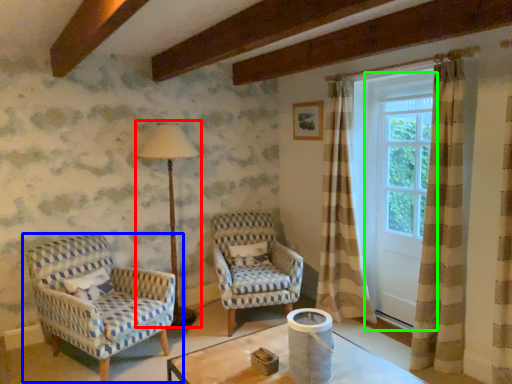
Question: Which object is positioned closest to table lamp (highlighted by a red box)? Select from chair (highlighted by a blue box) and screen door (highlighted by a green box).

Choices:
 (A) chair
 (B) screen door

Answer: (A)